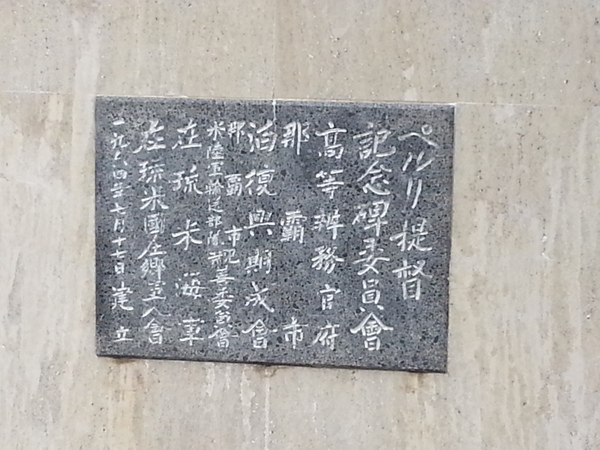
Locate an element on the screen. rectangle art work is located at coordinates (411, 190).